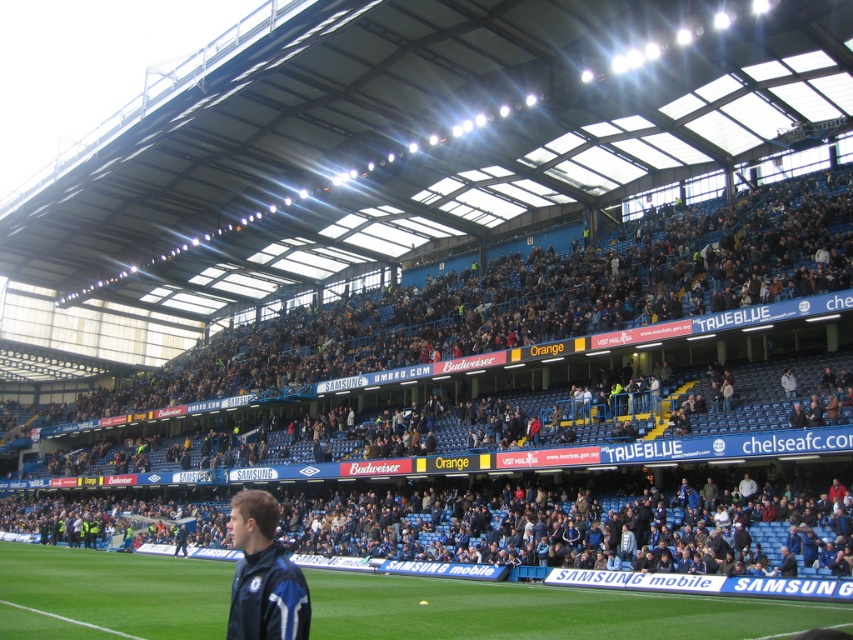
Question: Is blue fabric seats at upper center smaller than green grass at center?

Choices:
 (A) yes
 (B) no

Answer: (B)

Question: Which of the following is the farthest from the observer?

Choices:
 (A) (256, 589)
 (B) (556, 624)

Answer: (B)

Question: Which of the following is the closest to the observer?

Choices:
 (A) (383, 604)
 (B) (349, 528)

Answer: (A)

Question: Can you confirm if blue fabric seats at upper center is thinner than green grass at center?

Choices:
 (A) yes
 (B) no

Answer: (B)

Question: Which object appears closest to the camera in this image?

Choices:
 (A) blue fabric jacket at lower left
 (B) green grass at center
 (C) blue fabric seats at upper center

Answer: (A)

Question: Is green grass at center wider than blue fabric jacket at lower left?

Choices:
 (A) no
 (B) yes

Answer: (B)